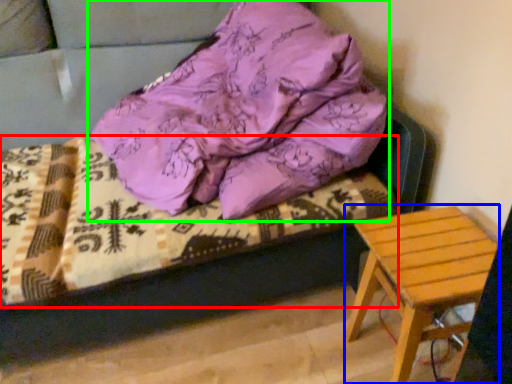
Question: Estimate the real-world distances between objects in this image. Which object is closer to bedding (highlighted by a red box), stool (highlighted by a blue box) or pillow (highlighted by a green box)?

Choices:
 (A) stool
 (B) pillow

Answer: (B)